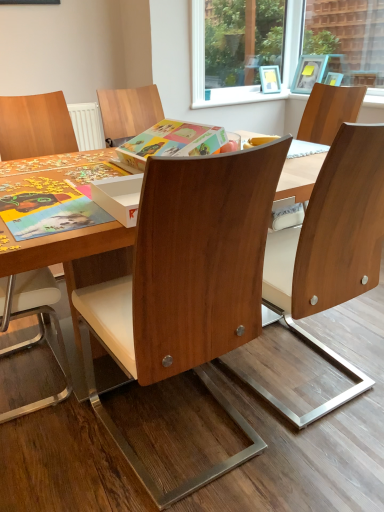
Identify the location of vacant area in front of wooden chair at left, the 1th chair in the left-to-right sequence. This screenshot has height=512, width=384. (53, 453).